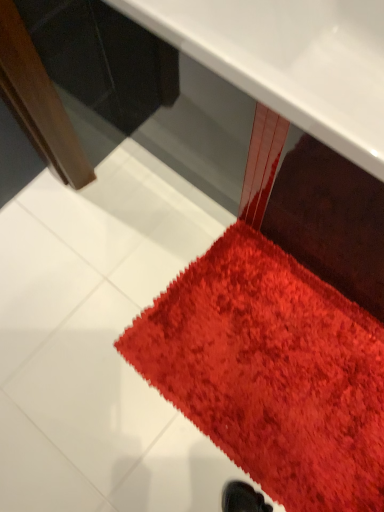
Question: Is the surface of shaggy red carpet at lower right in direct contact with glossy plastic table at center?

Choices:
 (A) yes
 (B) no

Answer: (B)

Question: From the image's perspective, would you say shaggy red carpet at lower right is shown under glossy plastic table at center?

Choices:
 (A) no
 (B) yes

Answer: (B)

Question: Does shaggy red carpet at lower right come behind glossy plastic table at center?

Choices:
 (A) no
 (B) yes

Answer: (B)

Question: Is shaggy red carpet at lower right smaller than glossy plastic table at center?

Choices:
 (A) yes
 (B) no

Answer: (A)

Question: Can you confirm if shaggy red carpet at lower right is taller than glossy plastic table at center?

Choices:
 (A) yes
 (B) no

Answer: (B)

Question: Would you say glossy plastic table at center is part of shaggy red carpet at lower right's contents?

Choices:
 (A) no
 (B) yes

Answer: (A)

Question: From the image's perspective, would you say glossy plastic table at center is positioned over shaggy red carpet at lower right?

Choices:
 (A) yes
 (B) no

Answer: (A)

Question: Is glossy plastic table at center turned away from shaggy red carpet at lower right?

Choices:
 (A) no
 (B) yes

Answer: (A)

Question: Is glossy plastic table at center oriented towards shaggy red carpet at lower right?

Choices:
 (A) no
 (B) yes

Answer: (A)

Question: Can you confirm if glossy plastic table at center is wider than shaggy red carpet at lower right?

Choices:
 (A) no
 (B) yes

Answer: (B)

Question: Considering the relative sizes of glossy plastic table at center and shaggy red carpet at lower right in the image provided, is glossy plastic table at center bigger than shaggy red carpet at lower right?

Choices:
 (A) yes
 (B) no

Answer: (A)

Question: Can you confirm if glossy plastic table at center is positioned to the left of shaggy red carpet at lower right?

Choices:
 (A) yes
 (B) no

Answer: (B)

Question: From the image's perspective, relative to shaggy red carpet at lower right, is glossy plastic table at center above or below?

Choices:
 (A) below
 (B) above

Answer: (B)